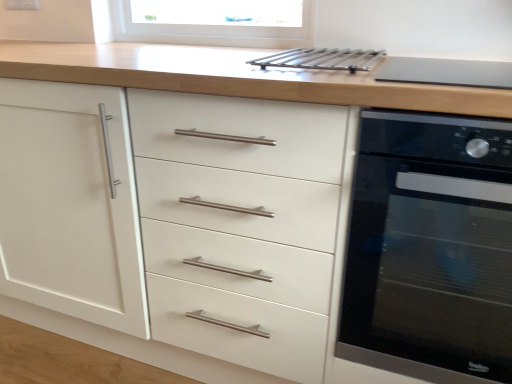
Question: Is metallic silver rack at upper center completely or partially inside matte black cooktop at upper right?

Choices:
 (A) no
 (B) yes

Answer: (A)

Question: Is matte black cooktop at upper right aimed at metallic silver rack at upper center?

Choices:
 (A) no
 (B) yes

Answer: (A)

Question: Is matte black cooktop at upper right facing away from metallic silver rack at upper center?

Choices:
 (A) no
 (B) yes

Answer: (A)

Question: Is matte black cooktop at upper right outside of metallic silver rack at upper center?

Choices:
 (A) no
 (B) yes

Answer: (B)

Question: Considering the relative sizes of matte black cooktop at upper right and metallic silver rack at upper center in the image provided, is matte black cooktop at upper right bigger than metallic silver rack at upper center?

Choices:
 (A) no
 (B) yes

Answer: (B)

Question: Is matte black cooktop at upper right to the left of metallic silver rack at upper center from the viewer's perspective?

Choices:
 (A) yes
 (B) no

Answer: (B)

Question: From the image's perspective, would you say metallic silver rack at upper center is positioned over matte black cooktop at upper right?

Choices:
 (A) yes
 (B) no

Answer: (A)

Question: Is metallic silver rack at upper center at the left side of matte black cooktop at upper right?

Choices:
 (A) no
 (B) yes

Answer: (B)

Question: From a real-world perspective, is metallic silver rack at upper center positioned under matte black cooktop at upper right based on gravity?

Choices:
 (A) yes
 (B) no

Answer: (B)

Question: Can you see metallic silver rack at upper center touching matte black cooktop at upper right?

Choices:
 (A) yes
 (B) no

Answer: (B)

Question: Is metallic silver rack at upper center wider than matte black cooktop at upper right?

Choices:
 (A) no
 (B) yes

Answer: (A)

Question: Is the position of metallic silver rack at upper center more distant than that of matte black cooktop at upper right?

Choices:
 (A) no
 (B) yes

Answer: (B)

Question: Is the surface of black glass oven at right in direct contact with matte black cooktop at upper right?

Choices:
 (A) yes
 (B) no

Answer: (B)